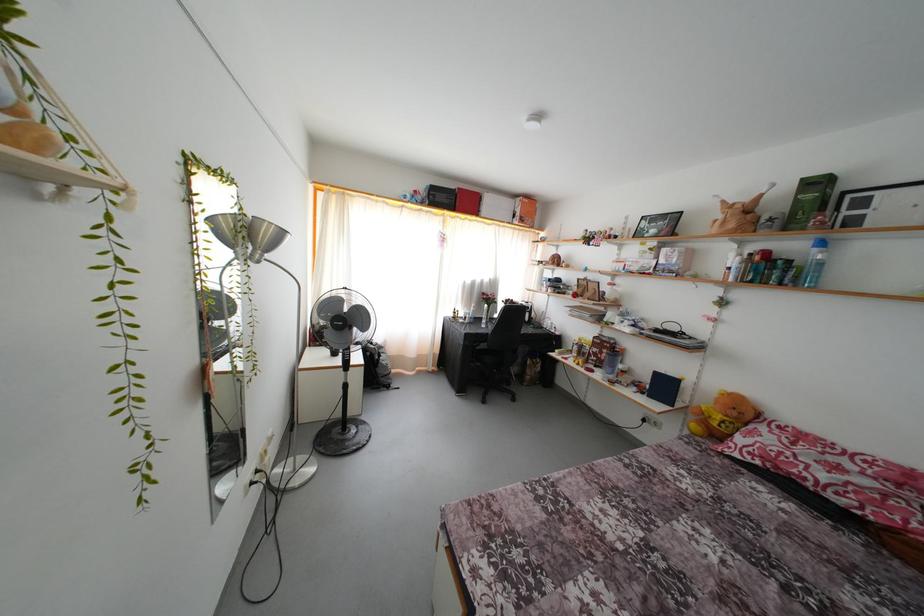
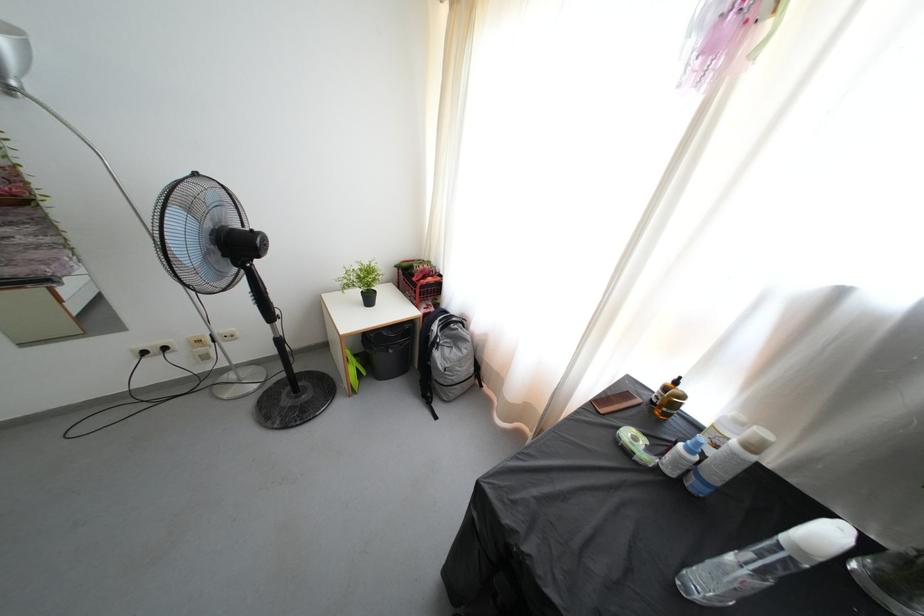
Locate, in the second image, the point that corresponds to pixel 468 329 in the first image.

(631, 458)